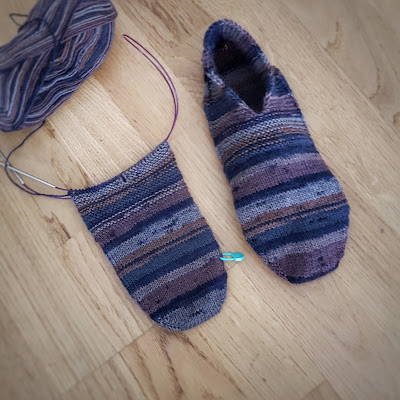
Where is `blue knitting yarn on (my) right slipper`? The image size is (400, 400). blue knitting yarn on (my) right slipper is located at coordinates (267, 123), (309, 194).